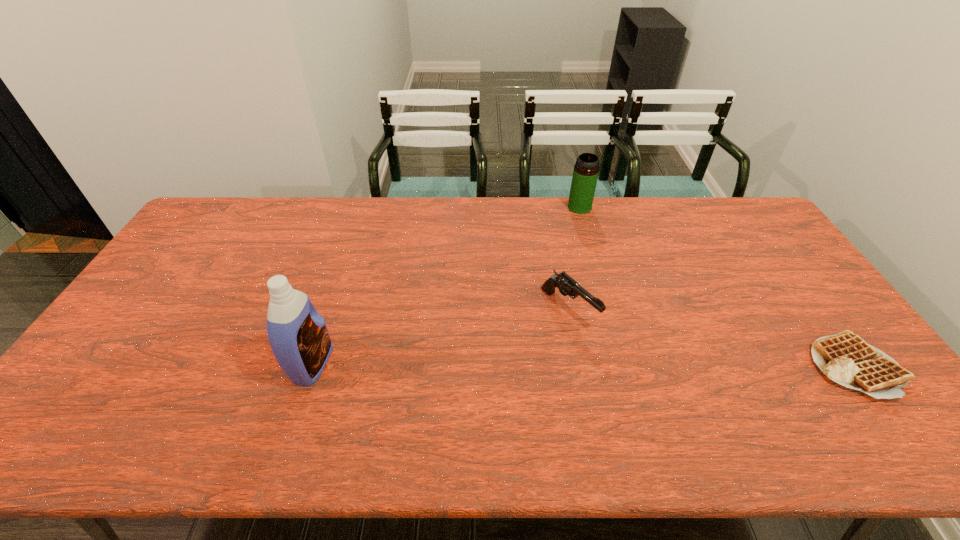
Identify the location of free space located at the end of the barrel of the gun. (625, 361).

The image size is (960, 540). Identify the location of free region located 0.270m at the end of the barrel of the gun. (670, 400).

The image size is (960, 540). I want to click on vacant space located 0.150m from the spout of the third shortest object, so click(x=584, y=240).

This screenshot has height=540, width=960. I want to click on free space located from the spout of the third shortest object, so click(x=588, y=266).

The image size is (960, 540). Find the location of `free space located from the spout of the third shortest object`. free space located from the spout of the third shortest object is located at coordinates (582, 222).

Locate an element on the screen. The width and height of the screenshot is (960, 540). object located in the far edge section of the desktop is located at coordinates (585, 174).

In order to click on detergent present at the near edge in this screenshot , I will do `click(298, 335)`.

Find the location of `waffle at the near edge`. waffle at the near edge is located at coordinates (845, 358).

Identify the location of object that is positioned at the right edge. The height and width of the screenshot is (540, 960). (845, 358).

This screenshot has height=540, width=960. What are the coordinates of `object at the near right corner` in the screenshot? It's located at (845, 358).